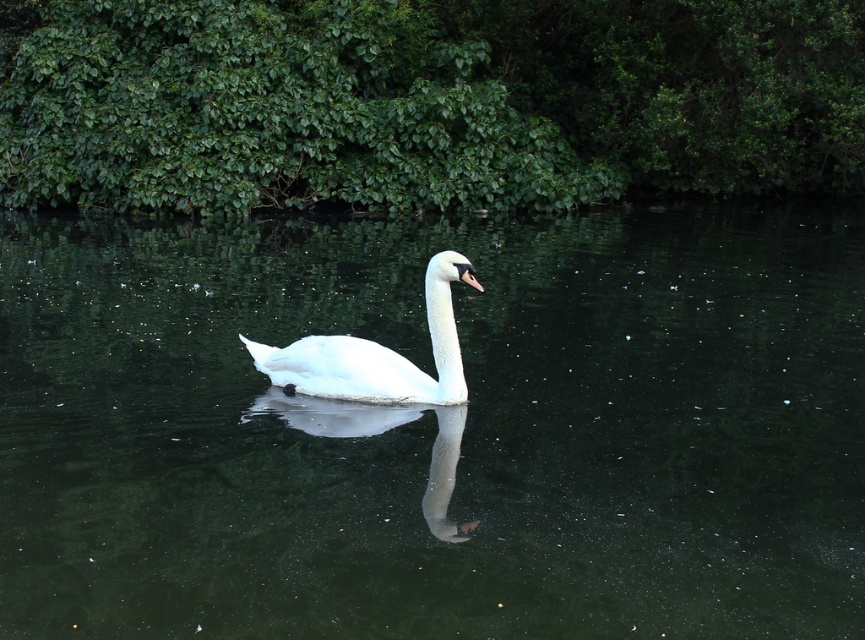
You are standing on the shore observing the scene. Which object, the clear dark water at center or the white glossy swan at center, is positioned to the right side of the other?

The clear dark water at center is positioned to the right of the white glossy swan at center.

You are a photographer standing at the edge of the water. You want to capture the reflection of the swan in the clear dark water at center. Based on the scene description, where should you position your camera to ensure the reflection is fully visible?

The clear dark water at center is located at point (x=436, y=428). To capture the reflection, position the camera at the edge of the water facing towards the clear dark water at center to ensure the reflection is fully visible.

You are a photographer trying to capture the reflection of the white glossy swan at center in the clear dark water at center. Based on the scene description, can you confirm if the reflection is visible in the water?

The clear dark water at center is above the white glossy swan at center, so the reflection of the white glossy swan at center would be visible in the clear dark water at center as reflections typically appear above the object in water.